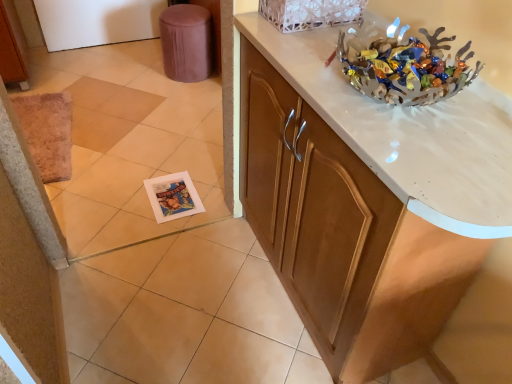
At what (x,y) coordinates should I click in order to perform the action: click on brown fabric stool at upper left. Please return your answer as a coordinate pair (x, y). This screenshot has width=512, height=384. Looking at the image, I should click on (186, 42).

Find the location of a particular element. The image size is (512, 384). white lace basket at upper center is located at coordinates (311, 13).

You are a GUI agent. You are given a task and a screenshot of the screen. Output one action in this format:
    pyautogui.click(x=<x>, y=<y>)
    Task: Click on the metallic silver bowl at upper right
    The width and height of the screenshot is (512, 384).
    Given the screenshot: What is the action you would take?
    pyautogui.click(x=404, y=66)

Who is smaller, white lace basket at upper center or metallic silver bowl at upper right?

Smaller between the two is white lace basket at upper center.

Does white lace basket at upper center appear on the right side of metallic silver bowl at upper right?

In fact, white lace basket at upper center is to the left of metallic silver bowl at upper right.

Considering the relative sizes of white lace basket at upper center and metallic silver bowl at upper right in the image provided, is white lace basket at upper center taller than metallic silver bowl at upper right?

Yes, white lace basket at upper center is taller than metallic silver bowl at upper right.

This screenshot has width=512, height=384. What are the coordinates of `stuff below the white lace basket at upper center (from a real-world perspective)` in the screenshot? It's located at (404, 66).

In the scene shown: Is brown fabric stool at upper left not close to white lace basket at upper center?

Yes, brown fabric stool at upper left and white lace basket at upper center are quite far apart.

In terms of width, does brown fabric stool at upper left look wider or thinner when compared to white lace basket at upper center?

Considering their sizes, brown fabric stool at upper left looks broader than white lace basket at upper center.

I want to click on stool behind the white lace basket at upper center, so click(x=186, y=42).

Is brown fabric stool at upper left oriented away from white lace basket at upper center?

No, brown fabric stool at upper left is not facing away from white lace basket at upper center.

How much distance is there between white marble countertop at upper right and metallic silver bowl at upper right?

They are 4.23 inches apart.

Consider the image. Considering the sizes of objects white marble countertop at upper right and metallic silver bowl at upper right in the image provided, who is bigger, white marble countertop at upper right or metallic silver bowl at upper right?

white marble countertop at upper right.

Considering the sizes of objects white marble countertop at upper right and metallic silver bowl at upper right in the image provided, who is shorter, white marble countertop at upper right or metallic silver bowl at upper right?

Standing shorter between the two is metallic silver bowl at upper right.

Is white marble countertop at upper right not near metallic silver bowl at upper right?

They are positioned close to each other.

Considering the positions of objects white marble countertop at upper right and brown fabric stool at upper left in the image provided, who is more to the right, white marble countertop at upper right or brown fabric stool at upper left?

white marble countertop at upper right.

Does point (401, 115) lie in front of point (165, 36)?

Yes, it is in front of point (165, 36).

From a real-world perspective, is white marble countertop at upper right under brown fabric stool at upper left?

No, from a real-world perspective, white marble countertop at upper right is not under brown fabric stool at upper left.

Between metallic silver bowl at upper right and white marble countertop at upper right, which one has larger width?

With larger width is white marble countertop at upper right.

Would you say metallic silver bowl at upper right is outside white marble countertop at upper right?

Yes.

From a real-world perspective, which is physically above, metallic silver bowl at upper right or white marble countertop at upper right?

metallic silver bowl at upper right is physically above.

Is brown fabric stool at upper left oriented towards white marble countertop at upper right?

Yes.

From a real-world perspective, is brown fabric stool at upper left physically located above or below white marble countertop at upper right?

In terms of real-world spatial position, brown fabric stool at upper left is below white marble countertop at upper right.

Does point (203, 59) lie behind point (497, 167)?

Yes.

Is the depth of brown fabric stool at upper left greater than that of white marble countertop at upper right?

Yes, the depth of brown fabric stool at upper left is greater than that of white marble countertop at upper right.

Is white lace basket at upper center positioned beyond the bounds of white marble countertop at upper right?

Yes.

You are a GUI agent. You are given a task and a screenshot of the screen. Output one action in this format:
    pyautogui.click(x=<x>, y=<y>)
    Task: Click on the countertop below the white lace basket at upper center (from the image's perspective)
    This screenshot has width=512, height=384.
    Given the screenshot: What is the action you would take?
    pyautogui.click(x=406, y=136)

Which object is closer to the camera taking this photo, white lace basket at upper center or white marble countertop at upper right?

Positioned in front is white marble countertop at upper right.

In the scene shown: Would you say white lace basket at upper center is to the left or to the right of white marble countertop at upper right in the picture?

white lace basket at upper center is positioned on white marble countertop at upper right's left side.

Find the location of `stuff directly beneath the white lace basket at upper center (from a real-world perspective)`. stuff directly beneath the white lace basket at upper center (from a real-world perspective) is located at coordinates (404, 66).

This screenshot has width=512, height=384. Find the location of `basket on the right of brown fabric stool at upper left`. basket on the right of brown fabric stool at upper left is located at coordinates click(x=311, y=13).

From the image, which object appears to be nearer to white marble countertop at upper right, brown fabric stool at upper left or white lace basket at upper center?

Based on the image, white lace basket at upper center appears to be nearer to white marble countertop at upper right.

From the image, which object appears to be farther from white lace basket at upper center, brown fabric stool at upper left or metallic silver bowl at upper right?

brown fabric stool at upper left is further to white lace basket at upper center.

Which object lies nearer to the anchor point brown fabric stool at upper left, metallic silver bowl at upper right or white lace basket at upper center?

white lace basket at upper center lies closer to brown fabric stool at upper left than the other object.

Considering their positions, is white marble countertop at upper right positioned further to brown fabric stool at upper left than metallic silver bowl at upper right?

metallic silver bowl at upper right lies further to brown fabric stool at upper left than the other object.

When comparing their distances from white marble countertop at upper right, does metallic silver bowl at upper right or white lace basket at upper center seem further?

Based on the image, white lace basket at upper center appears to be further to white marble countertop at upper right.

When comparing their distances from metallic silver bowl at upper right, does brown fabric stool at upper left or white marble countertop at upper right seem closer?

white marble countertop at upper right lies closer to metallic silver bowl at upper right than the other object.

Considering their positions, is white lace basket at upper center positioned closer to metallic silver bowl at upper right than brown fabric stool at upper left?

The object closer to metallic silver bowl at upper right is white lace basket at upper center.

Consider the image. Looking at the image, which one is located further to metallic silver bowl at upper right, brown fabric stool at upper left or white lace basket at upper center?

The object further to metallic silver bowl at upper right is brown fabric stool at upper left.

Find the location of a particular element. The width and height of the screenshot is (512, 384). stuff between white marble countertop at upper right and brown fabric stool at upper left from front to back is located at coordinates (404, 66).

Locate an element on the screen. This screenshot has height=384, width=512. basket between metallic silver bowl at upper right and brown fabric stool at upper left from front to back is located at coordinates (311, 13).

You are a GUI agent. You are given a task and a screenshot of the screen. Output one action in this format:
    pyautogui.click(x=<x>, y=<y>)
    Task: Click on the basket between white marble countertop at upper right and brown fabric stool at upper left in the front-back direction
    This screenshot has width=512, height=384.
    Given the screenshot: What is the action you would take?
    pyautogui.click(x=311, y=13)

The height and width of the screenshot is (384, 512). In order to click on stuff that lies between white lace basket at upper center and white marble countertop at upper right from top to bottom in this screenshot , I will do `click(404, 66)`.